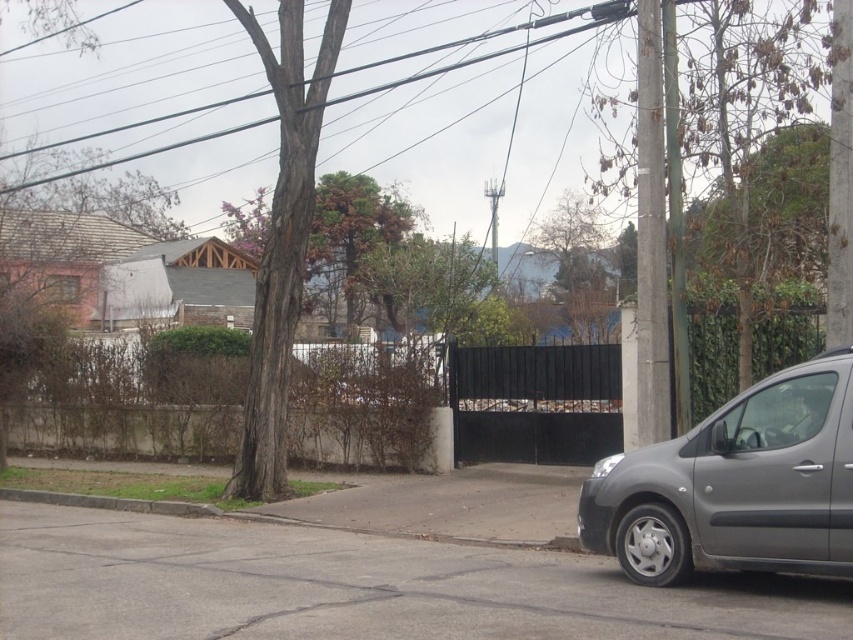
You are a delivery person standing at the entrance of the residential street. You need to deliver a package to a point that is closer to you. Which point should you go to, point (311, 90) or point (171, 502)?

Point (311, 90) is further to the viewer than point (171, 502). Therefore, the closer point to you is point (171, 502), so you should go to point (171, 502).

You are standing at the center of the residential street and see the satin gray van at right. Based on its 2D location coordinates, can you determine if the van is closer to the front of the image or the back?

The satin gray van at right is located at coordinates point (735, 484), which places it closer to the back of the image since the coordinates are closer to the upper right corner.

You are a delivery driver who needs to park your satin gray van at right in a spot that allows clearance under the brown rough bark tree at center. Based on the scene, will the van fit under the tree without hitting its branches?

The satin gray van at right is not as tall as the brown rough bark tree at center, so it should fit under the tree without hitting the branches.